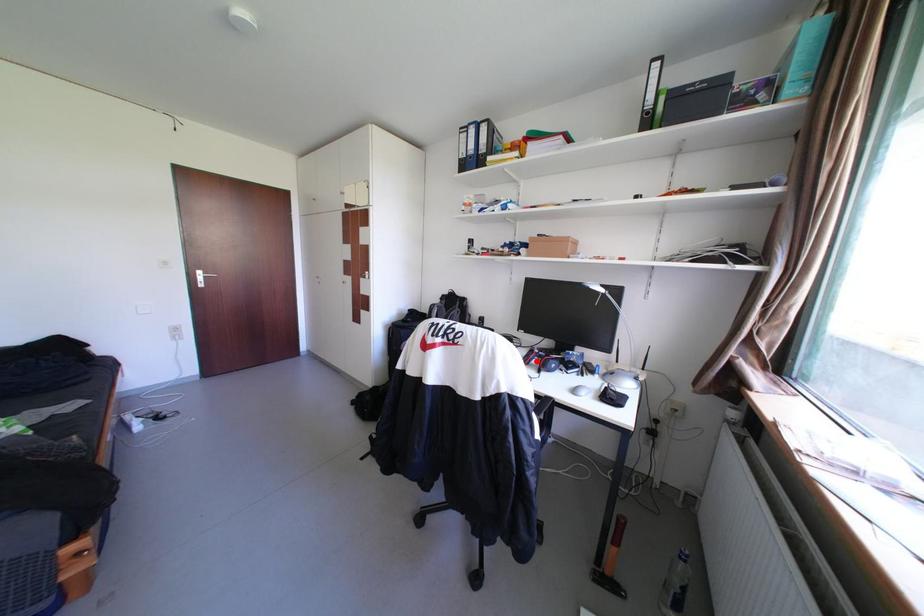
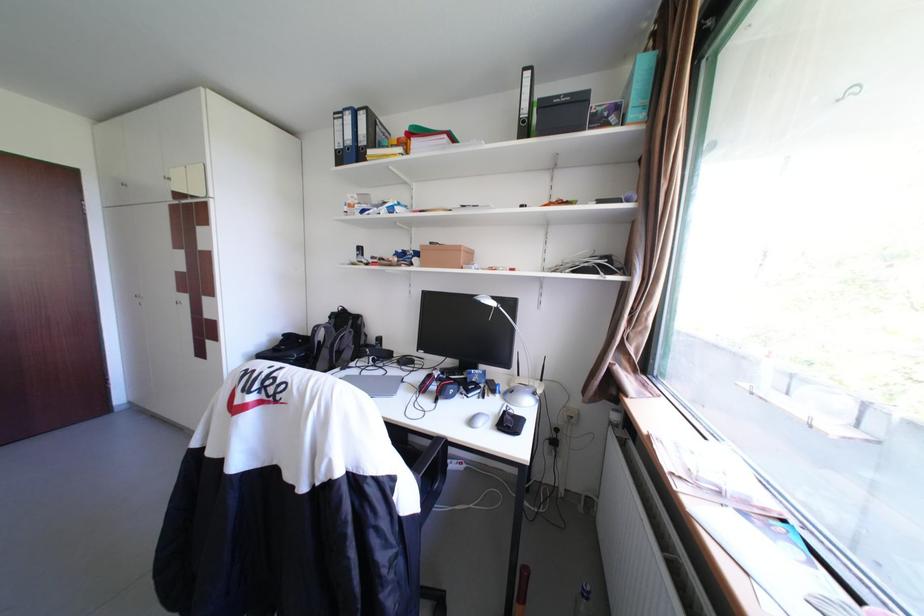
The point at the highlighted location is marked in the first image. Where is the corresponding point in the second image?

(433, 389)